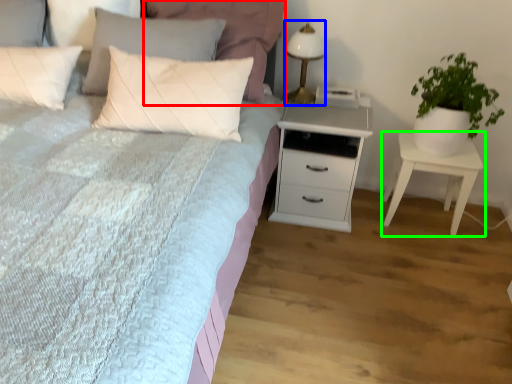
Question: Which object is the closest to the pillow (highlighted by a red box)? Choose among these: bedside lamp (highlighted by a blue box) or nightstand (highlighted by a green box).

Choices:
 (A) bedside lamp
 (B) nightstand

Answer: (A)